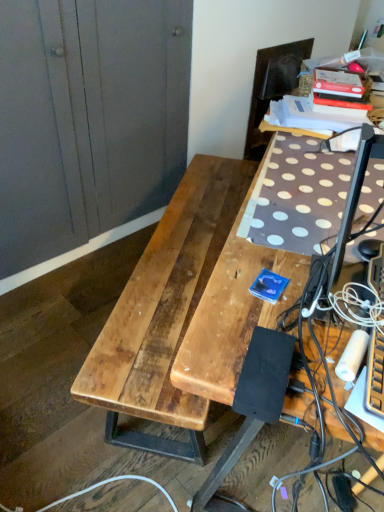
Question: Would you say black rubber extension cord at lower right is inside or outside dark brown leather swivel chair at upper right?

Choices:
 (A) outside
 (B) inside

Answer: (A)

Question: From a real-world perspective, is black rubber extension cord at lower right physically located above or below dark brown leather swivel chair at upper right?

Choices:
 (A) above
 (B) below

Answer: (B)

Question: Which object is positioned farthest from the dark brown leather swivel chair at upper right?

Choices:
 (A) wooden dresser at left
 (B) black rubber extension cord at lower right
 (C) natural wood table at center
 (D) brown wooden desk at center

Answer: (B)

Question: Based on their relative distances, which object is farther from the dark brown leather swivel chair at upper right?

Choices:
 (A) natural wood table at center
 (B) black rubber extension cord at lower right
 (C) brown wooden desk at center
 (D) wooden dresser at left

Answer: (B)